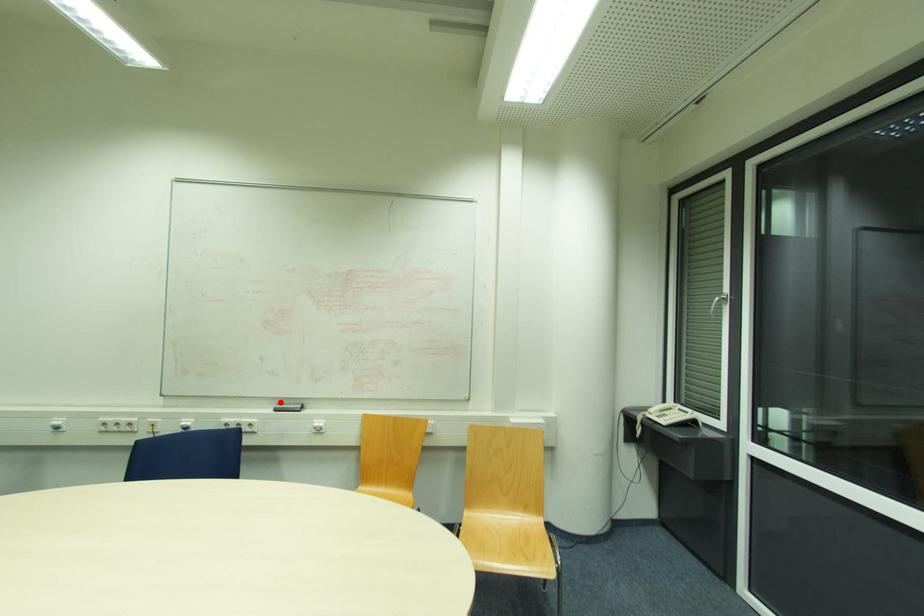
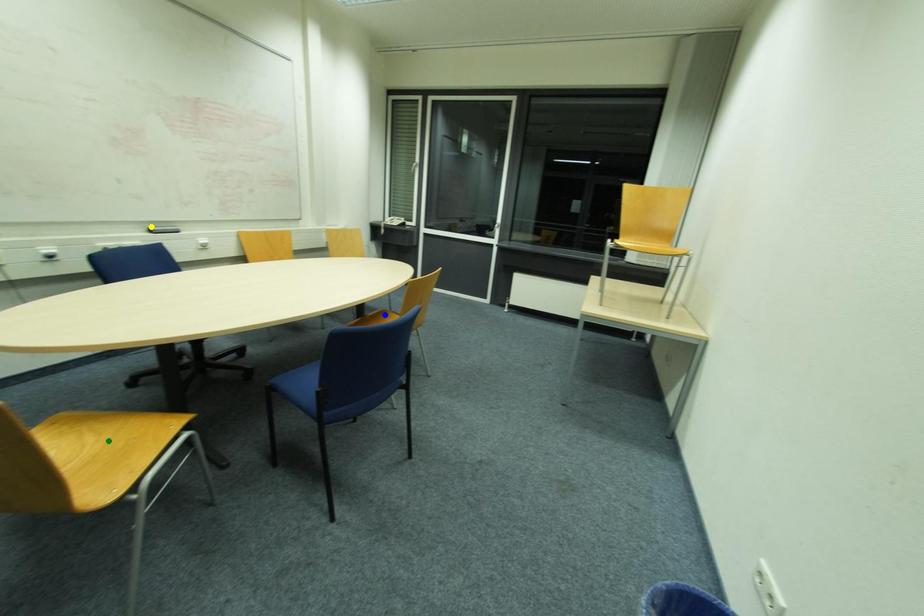
Question: I am providing you with two images of the same scene from different viewpoints. A red point is marked on the first image. You are given multiple points on the second image. Which point in image 2 is actually the same real-world point as the red point in image 1?

Choices:
 (A) blue point
 (B) yellow point
 (C) green point

Answer: (B)